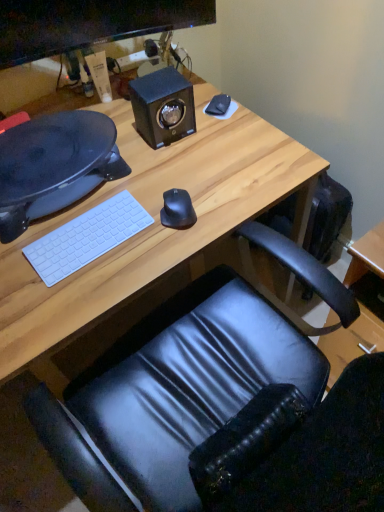
The height and width of the screenshot is (512, 384). Find the location of `free location to the right of black textured speaker at upper center`. free location to the right of black textured speaker at upper center is located at coordinates (223, 131).